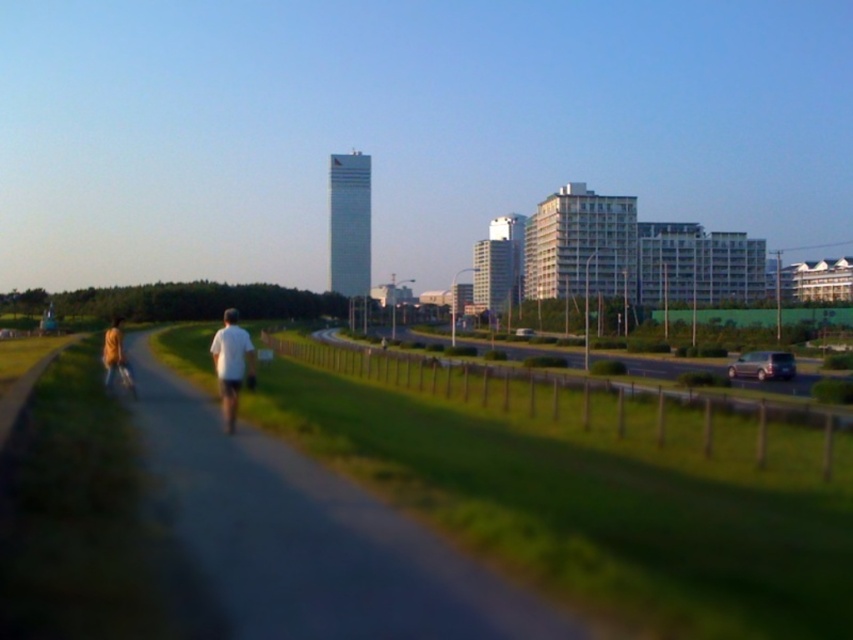
You are a pedestrian standing on the gray asphalt path at center and want to approach the white matte shirt at center. Which direction should you move to reach them?

The gray asphalt path at center is positioned on the right side of white matte shirt at center. To reach them, you should move to your left.

You are a delivery robot with a width of 1.2 meters. You need to navigate from the gray asphalt path at center to the white matte shirt at center. Can you fit through the space between them without moving sideways?

The distance between the gray asphalt path at center and the white matte shirt at center is 2.56 meters. Since the robot is 1.2 meters wide, it can fit through the space as the distance is greater than the robot width.